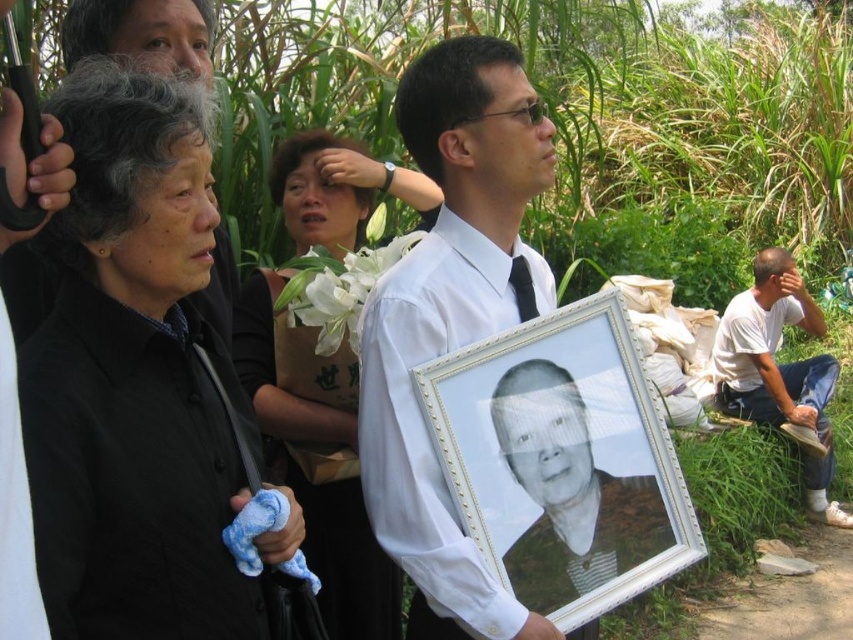
Question: Which point is closer to the camera taking this photo?

Choices:
 (A) (30, 408)
 (B) (521, 563)

Answer: (A)

Question: Which object is closer to the camera taking this photo?

Choices:
 (A) white cotton shirt at lower right
 (B) black glossy photo frame at center
 (C) white glossy photo frame at center

Answer: (C)

Question: Among these objects, which one is nearest to the camera?

Choices:
 (A) white wooden picture frame at center
 (B) black satin tie at center
 (C) white glossy photo frame at center

Answer: (C)

Question: Is matte black dress at center below black satin tie at center?

Choices:
 (A) no
 (B) yes

Answer: (B)

Question: Observing the image, what is the correct spatial positioning of black matte jacket at upper left in reference to white cotton shirt at lower right?

Choices:
 (A) left
 (B) right

Answer: (A)

Question: Can you confirm if black matte jacket at upper left is positioned below matte black dress at center?

Choices:
 (A) yes
 (B) no

Answer: (B)